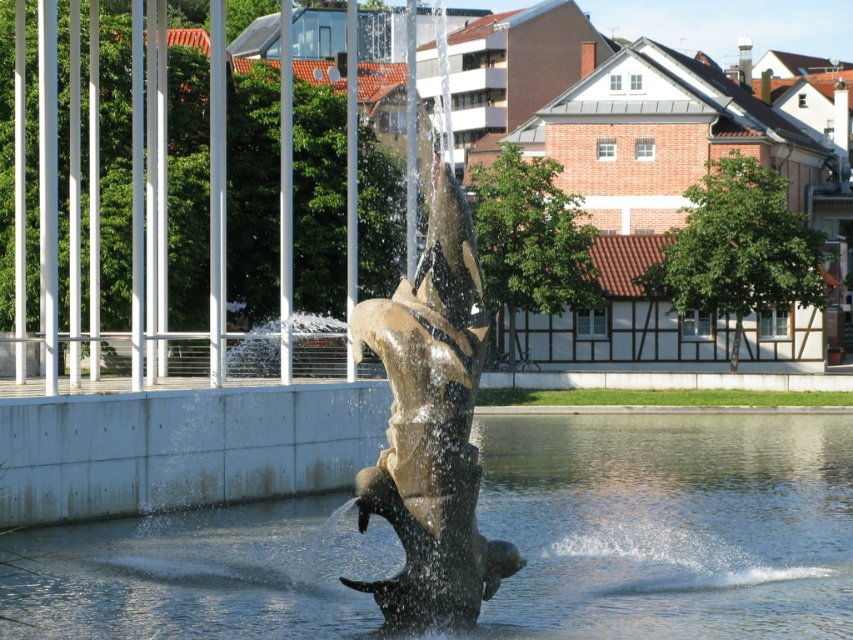
Is clear water at center positioned in front of gold polished metal fish at center?

No.

Where is `clear water at center`? This screenshot has width=853, height=640. clear water at center is located at coordinates (669, 524).

Find the location of `clear water at center`. clear water at center is located at coordinates (669, 524).